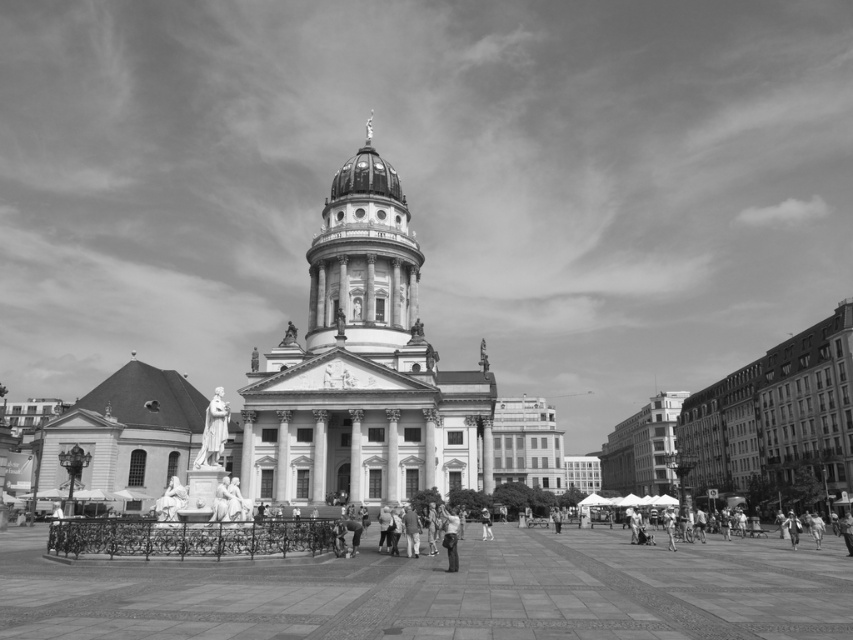
You are an architect planning to install a new sculpture between the white marble church at center and the smooth stone column at center. The sculpture requires a minimum of 15 meters of space between them. Is there enough space for the sculpture?

The white marble church at center and smooth stone column at center are 15.54 meters apart, which exceeds the required 15 meters. Therefore, there is sufficient space for the sculpture between them.

You are an architect visiting the urban square and want to take a photo of both the white marble church at center and the smooth stone column at center. Since you have a camera with a fixed focal length, you need to ensure both objects are fully visible in the frame. Based on their sizes, which object should you position closer to the camera to include both in the composition?

The white marble church at center is bigger than the smooth stone column at center. To include both in the frame, position the smaller smooth stone column at center closer to the camera so that its size in the photo matches the larger church.